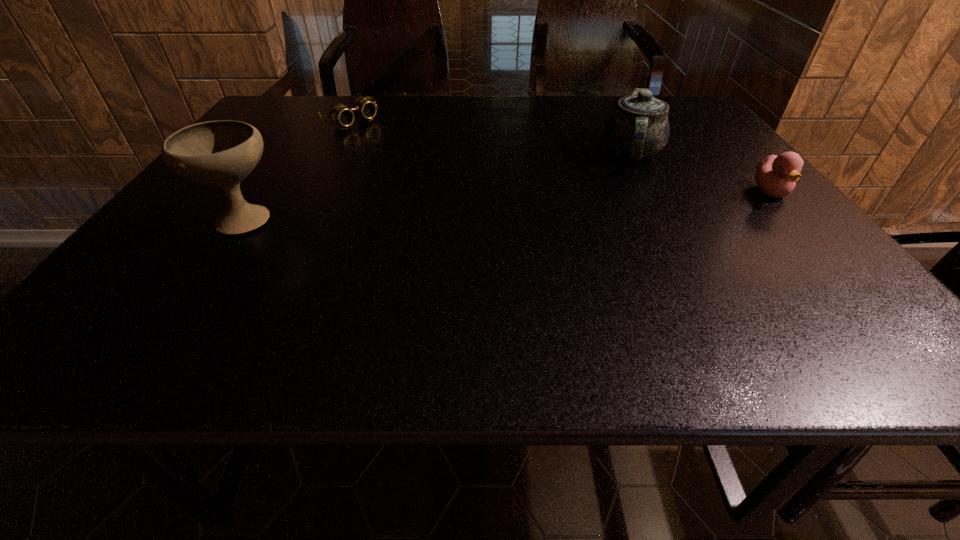
The height and width of the screenshot is (540, 960). I want to click on free space located 0.230m through the lenses of the goggles, so click(416, 159).

Image resolution: width=960 pixels, height=540 pixels. In order to click on vacant point located from the spout of the chinaware in this screenshot , I will do `click(561, 243)`.

Identify the location of vacant space positioned 0.050m from the spout of the chinaware. (615, 181).

This screenshot has height=540, width=960. Find the location of `vacant area situated from the spout of the chinaware`. vacant area situated from the spout of the chinaware is located at coordinates tap(608, 191).

Locate an element on the screen. object at the far edge is located at coordinates [339, 114].

Locate an element on the screen. The image size is (960, 540). object that is at the left edge is located at coordinates pyautogui.click(x=222, y=153).

This screenshot has height=540, width=960. I want to click on object present at the right edge, so click(776, 176).

This screenshot has width=960, height=540. In the image, there is a desktop. In order to click on vacant space at the far edge in this screenshot , I will do `click(442, 102)`.

Locate an element on the screen. Image resolution: width=960 pixels, height=540 pixels. vacant area at the near edge is located at coordinates (298, 279).

Where is `free space at the left edge of the desktop`? The width and height of the screenshot is (960, 540). free space at the left edge of the desktop is located at coordinates (253, 193).